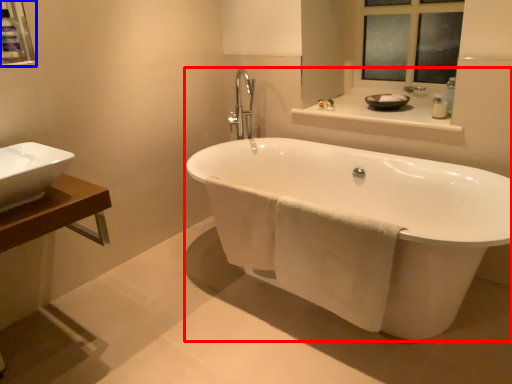
Question: Which point is closer to the camera, bathtub (highlighted by a red box) or medicine cabinet (highlighted by a blue box)?

Choices:
 (A) bathtub
 (B) medicine cabinet

Answer: (A)